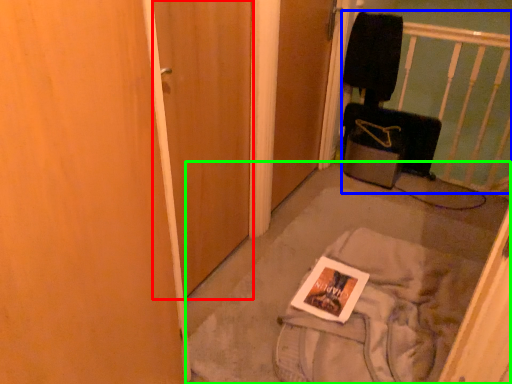
Question: Considering the real-world distances, which object is farthest from door (highlighted by a red box)? infant bed (highlighted by a blue box) or concrete (highlighted by a green box)?

Choices:
 (A) infant bed
 (B) concrete

Answer: (A)